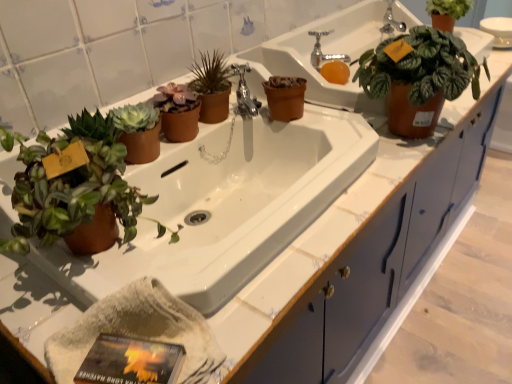
Question: Which direction should I rotate to face matte brown pot at center, placed as the third houseplant when sorted from right to left, — up or down?

Choices:
 (A) down
 (B) up

Answer: (B)

Question: From the image's perspective, is green matte plant at upper right, the 1th houseplant positioned from the back, located beneath polished chrome faucet at center?

Choices:
 (A) yes
 (B) no

Answer: (B)

Question: Does green matte plant at upper right, placed as the fourth houseplant when sorted from front to back, have a lesser width compared to polished chrome faucet at center?

Choices:
 (A) no
 (B) yes

Answer: (A)

Question: Is green matte plant at upper right, positioned as the 4th houseplant in left-to-right order, completely or partially outside of polished chrome faucet at center?

Choices:
 (A) no
 (B) yes

Answer: (B)

Question: Are green matte plant at upper right, placed as the fourth houseplant when sorted from front to back, and polished chrome faucet at center making contact?

Choices:
 (A) yes
 (B) no

Answer: (B)

Question: Considering the relative sizes of green matte plant at upper right, placed as the fourth houseplant when sorted from front to back, and polished chrome faucet at center in the image provided, is green matte plant at upper right, placed as the fourth houseplant when sorted from front to back, shorter than polished chrome faucet at center?

Choices:
 (A) no
 (B) yes

Answer: (A)

Question: Is green matte plant at upper right, positioned as the 4th houseplant in left-to-right order, positioned with its back to polished chrome faucet at center?

Choices:
 (A) yes
 (B) no

Answer: (B)

Question: Is green matte plant at upper right, the 1th houseplant positioned from the back, oriented away from matte brown pot at center, placed as the third houseplant when sorted from right to left?

Choices:
 (A) yes
 (B) no

Answer: (B)

Question: Is there a large distance between green matte plant at upper right, the first houseplant viewed from the right, and matte brown pot at center, the second houseplant from the back?

Choices:
 (A) yes
 (B) no

Answer: (B)

Question: Is the position of green matte plant at upper right, positioned as the 4th houseplant in left-to-right order, more distant than that of matte brown pot at center, which is counted as the 3th houseplant, starting from the front?

Choices:
 (A) no
 (B) yes

Answer: (B)

Question: Is green matte plant at upper right, the 1th houseplant positioned from the back, thinner than matte brown pot at center, placed as the third houseplant when sorted from right to left?

Choices:
 (A) no
 (B) yes

Answer: (A)

Question: Considering the relative sizes of green matte plant at upper right, the first houseplant viewed from the right, and matte brown pot at center, which is counted as the 2th houseplant, starting from the left, in the image provided, is green matte plant at upper right, the first houseplant viewed from the right, shorter than matte brown pot at center, which is counted as the 2th houseplant, starting from the left,?

Choices:
 (A) yes
 (B) no

Answer: (A)

Question: Does green matte plant at upper right, positioned as the 4th houseplant in left-to-right order, come in front of matte brown pot at center, the second houseplant from the back?

Choices:
 (A) no
 (B) yes

Answer: (A)

Question: Can you confirm if matte brown pot at center, which is counted as the 3th houseplant, starting from the front, is shorter than green matte plant at upper right, the second houseplant positioned from the front?

Choices:
 (A) no
 (B) yes

Answer: (B)